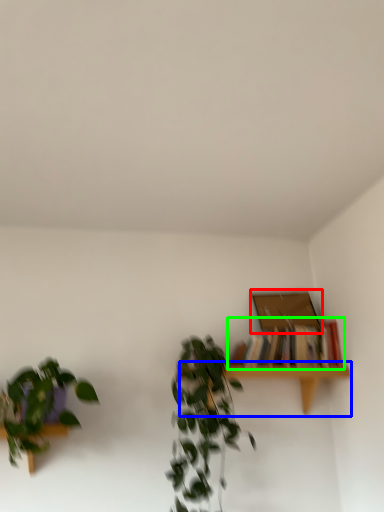
Question: Based on their relative distances, which object is farther from box (highlighted by a red box)? Choose from table (highlighted by a blue box) and book (highlighted by a green box).

Choices:
 (A) table
 (B) book

Answer: (A)